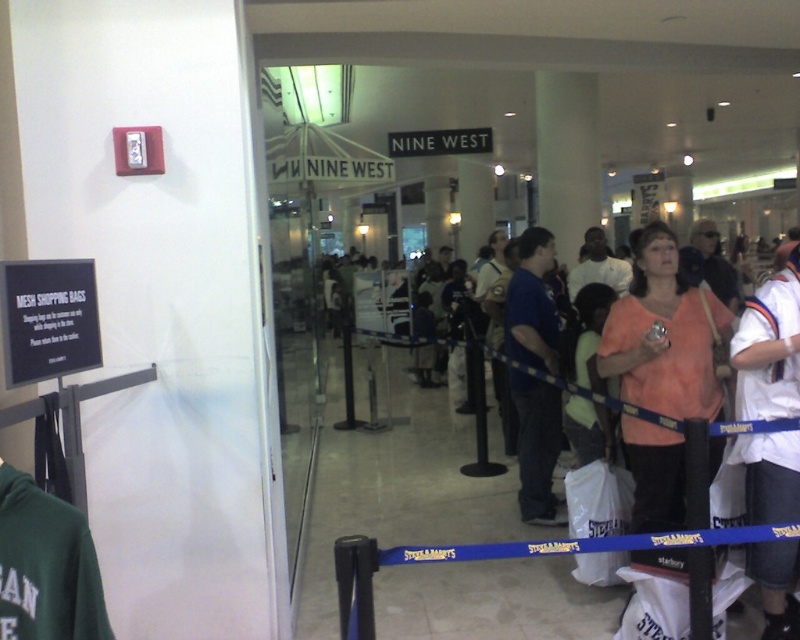
You are a customer in the shopping mall and see both the white cotton shirt at center and the blue cotton shirt at center displayed in the store. Which shirt is located to the right when facing the store entrance?

The white cotton shirt at center is positioned on the right side of the blue cotton shirt at center, so when facing the store entrance, the white cotton shirt at center is to the right of the blue cotton shirt at center.

You are a customer in the mall and see both the white cotton shirt at center and the blue cotton shirt at center displayed in the store. Which shirt is shorter in height?

The white cotton shirt at center is shorter in height compared to the blue cotton shirt at center.

You are trying to decide which shirt to take from the store. Both the white cotton shirt at center and the blue cotton shirt at center are available. If you want to carry the smaller one, which one should you choose?

The white cotton shirt at center occupies less space than the blue cotton shirt at center, so you should choose the white cotton shirt at center.